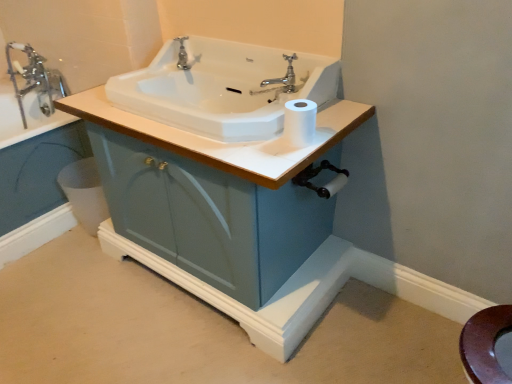
Consider the image. Measure the distance between white glossy bidet at lower left and camera.

white glossy bidet at lower left is 1.79 meters away from camera.

In order to face polished chrome faucet at upper center, placed as the 1th tap when sorted from front to back, should I rotate leftwards or rightwards?

To face it directly, rotate left by 9.408 degrees.

Measure the distance between point (318, 92) and camera.

They are 1.37 meters apart.

This screenshot has width=512, height=384. What are the coordinates of `white ceramic sink at center` in the screenshot? It's located at click(x=223, y=88).

This screenshot has height=384, width=512. Describe the element at coordinates (35, 80) in the screenshot. I see `chrome metallic faucet at upper left, marked as the 2th tap in a front-to-back arrangement` at that location.

What are the coordinates of `matte blue cabinet at center` in the screenshot? It's located at (225, 143).

Is chrome metallic faucet at upper left, the 2th tap positioned from the right, aimed at white glossy bidet at lower left?

No, chrome metallic faucet at upper left, the 2th tap positioned from the right, is not oriented towards white glossy bidet at lower left.

Considering the relative sizes of chrome metallic faucet at upper left, the 2th tap positioned from the right, and white glossy bidet at lower left in the image provided, is chrome metallic faucet at upper left, the 2th tap positioned from the right, taller than white glossy bidet at lower left?

Yes.

Is chrome metallic faucet at upper left, which is the first tap from back to front, not inside white glossy bidet at lower left?

Absolutely, chrome metallic faucet at upper left, which is the first tap from back to front, is external to white glossy bidet at lower left.

In terms of size, does white matte toilet paper at upper center appear bigger or smaller than matte blue cabinet at center?

white matte toilet paper at upper center is smaller than matte blue cabinet at center.

Where is `toilet paper positioned vertically above the matte blue cabinet at center (from a real-world perspective)`? toilet paper positioned vertically above the matte blue cabinet at center (from a real-world perspective) is located at coordinates (300, 122).

From a real-world perspective, who is located higher, white matte toilet paper at upper center or matte blue cabinet at center?

From a 3D spatial view, white matte toilet paper at upper center is above.

Could you tell me if white matte toilet paper at upper center is turned towards matte blue cabinet at center?

No, white matte toilet paper at upper center is not oriented towards matte blue cabinet at center.

From a real-world perspective, between polished chrome faucet at upper center, which is the 2th tap from back to front, and white glossy bidet at lower left, who is vertically higher?

polished chrome faucet at upper center, which is the 2th tap from back to front, from a real-world perspective.

In the scene shown: Is polished chrome faucet at upper center, which is the 2th tap from back to front, positioned beyond the bounds of white glossy bidet at lower left?

Indeed, polished chrome faucet at upper center, which is the 2th tap from back to front, is completely outside white glossy bidet at lower left.

Can you confirm if polished chrome faucet at upper center, acting as the first tap starting from the right, is taller than white glossy bidet at lower left?

In fact, polished chrome faucet at upper center, acting as the first tap starting from the right, may be shorter than white glossy bidet at lower left.

Can you tell me how much polished chrome faucet at upper center, which is the 2th tap from back to front, and white glossy bidet at lower left differ in facing direction?

91.4 degrees separate the facing orientations of polished chrome faucet at upper center, which is the 2th tap from back to front, and white glossy bidet at lower left.

Does polished chrome faucet at upper center, placed as the 1th tap when sorted from front to back, have a smaller size compared to white matte toilet paper at upper center?

Yes.

Does polished chrome faucet at upper center, which is the 2th tap from back to front, have a lesser height compared to white matte toilet paper at upper center?

No, polished chrome faucet at upper center, which is the 2th tap from back to front, is not shorter than white matte toilet paper at upper center.

Visually, is polished chrome faucet at upper center, which is the 2th tap from back to front, positioned to the left or to the right of white matte toilet paper at upper center?

From the image, it's evident that polished chrome faucet at upper center, which is the 2th tap from back to front, is to the left of white matte toilet paper at upper center.

Does point (189, 68) come closer to viewer compared to point (295, 109)?

No, (189, 68) is behind (295, 109).

Which object is positioned more to the right, white glossy bidet at lower left or white matte toilet paper at upper center?

white matte toilet paper at upper center is more to the right.

How far apart are white glossy bidet at lower left and white matte toilet paper at upper center?

A distance of 1.10 meters exists between white glossy bidet at lower left and white matte toilet paper at upper center.

From a real-world perspective, is white glossy bidet at lower left physically below white matte toilet paper at upper center?

Indeed, from a real-world perspective, white glossy bidet at lower left is positioned beneath white matte toilet paper at upper center.

Does matte blue cabinet at center have a lesser width compared to white matte toilet paper at upper center?

Incorrect, the width of matte blue cabinet at center is not less than that of white matte toilet paper at upper center.

Is white matte toilet paper at upper center at the back of matte blue cabinet at center?

matte blue cabinet at center does not have its back to white matte toilet paper at upper center.

From the image's perspective, between matte blue cabinet at center and white matte toilet paper at upper center, which one is located above?

From the image's view, white matte toilet paper at upper center is above.

Can you tell me how much matte blue cabinet at center and white matte toilet paper at upper center differ in facing direction?

The angle between the facing direction of matte blue cabinet at center and the facing direction of white matte toilet paper at upper center is 0.98 degrees.

Consider the image. Are matte blue cabinet at center and white glossy bidet at lower left far apart?

No.

Measure the distance from matte blue cabinet at center to white glossy bidet at lower left.

They are 35.98 centimeters apart.

What's the angular difference between matte blue cabinet at center and white glossy bidet at lower left's facing directions?

There is a 0.851-degree angle between the facing directions of matte blue cabinet at center and white glossy bidet at lower left.

From the image's perspective, between matte blue cabinet at center and white glossy bidet at lower left, which one is located above?

matte blue cabinet at center, from the image's perspective.

From a real-world perspective, which tap is the 1st one above the white glossy bidet at lower left? Please provide its 2D coordinates.

[(35, 80)]

Identify the location of bathroom cabinet in front of the white matte toilet paper at upper center. This screenshot has width=512, height=384. click(x=225, y=143).

Estimate the real-world distances between objects in this image. Which object is closer to white ceramic sink at center, white matte toilet paper at upper center or white glossy bidet at lower left?

Based on the image, white matte toilet paper at upper center appears to be nearer to white ceramic sink at center.

From the picture: When comparing their distances from white matte toilet paper at upper center, does polished chrome faucet at upper center, acting as the first tap starting from the right, or white ceramic sink at center seem closer?

Based on the image, white ceramic sink at center appears to be nearer to white matte toilet paper at upper center.

Estimate the real-world distances between objects in this image. Which object is further from white ceramic sink at center, chrome metallic faucet at upper left, the 2th tap positioned from the right, or matte blue cabinet at center?

The object further to white ceramic sink at center is chrome metallic faucet at upper left, the 2th tap positioned from the right.

When comparing their distances from white matte toilet paper at upper center, does matte blue cabinet at center or polished chrome faucet at upper center, acting as the first tap starting from the right, seem closer?

Among the two, polished chrome faucet at upper center, acting as the first tap starting from the right, is located nearer to white matte toilet paper at upper center.

Looking at the image, which one is located closer to matte blue cabinet at center, polished chrome faucet at upper center, which ranks as the second tap in left-to-right order, or white glossy bidet at lower left?

The object closer to matte blue cabinet at center is white glossy bidet at lower left.

Which object lies further to the anchor point white glossy bidet at lower left, polished chrome faucet at upper center, which ranks as the second tap in left-to-right order, or chrome metallic faucet at upper left, marked as the 2th tap in a front-to-back arrangement?

Among the two, polished chrome faucet at upper center, which ranks as the second tap in left-to-right order, is located further to white glossy bidet at lower left.

Which object lies further to the anchor point chrome metallic faucet at upper left, which is the first tap from back to front, matte blue cabinet at center or white ceramic sink at center?

matte blue cabinet at center is further to chrome metallic faucet at upper left, which is the first tap from back to front.

From the picture: When comparing their distances from polished chrome faucet at upper center, which is the 2th tap from back to front, does white glossy bidet at lower left or white matte toilet paper at upper center seem closer?

white matte toilet paper at upper center.

The image size is (512, 384). In order to click on tap located between chrome metallic faucet at upper left, which is the first tap from back to front, and white matte toilet paper at upper center in the left-right direction in this screenshot , I will do `click(182, 54)`.

This screenshot has width=512, height=384. I want to click on tap situated between white glossy bidet at lower left and white matte toilet paper at upper center from left to right, so click(x=182, y=54).

This screenshot has width=512, height=384. Identify the location of tap between white ceramic sink at center and white glossy bidet at lower left from front to back. [x=182, y=54].

In order to click on tap between chrome metallic faucet at upper left, marked as the 2th tap in a front-to-back arrangement, and white ceramic sink at center from left to right in this screenshot , I will do `click(182, 54)`.